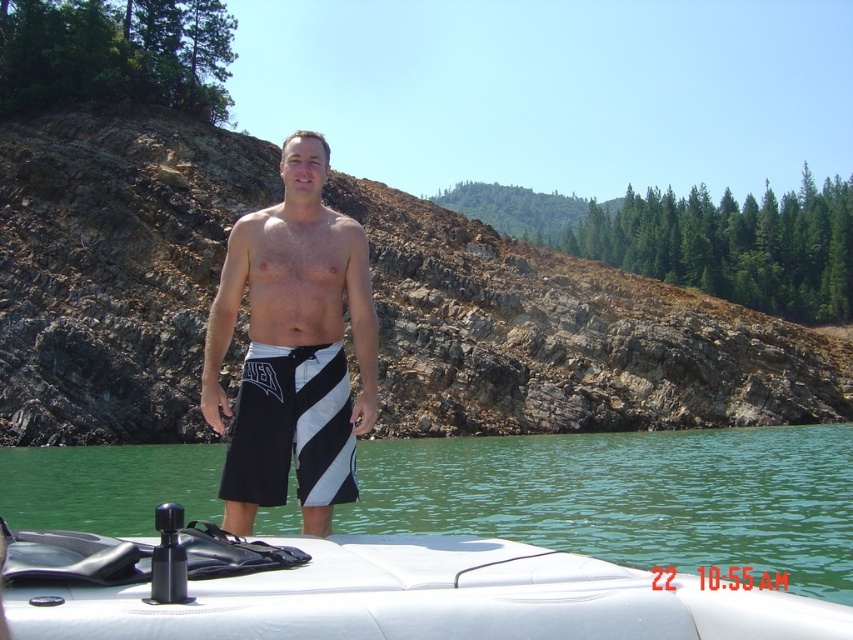
You are a photographer on the boat and want to take a picture of the black and white striped shorts at center and the green water at center. Which object is closer to the camera?

The green water at center is closer to the camera than the black and white striped shorts at center because the black and white striped shorts at center is behind green water at center.

You are a photographer trying to capture a photo of the green water at center and the black and white striped shorts at center from a distance of 70 feet. Will both subjects be in focus if your camera has a depth of field that can cover 70 feet?

The distance between the green water at center and the black and white striped shorts at center is 71.23 feet. Since the depth of field can only cover 70 feet, the subjects are slightly beyond the camera range, so both might not be in focus simultaneously.

You are a drone operator trying to locate the white matte boat at center in a satellite image. The satellite image has a coordinate system where the bottom left corner is at point 0.0 and the top right corner is at point 1.0. The boat is at point 0.923 in the x axis and 0.433 in the y axis. If you want to move the drone to the boat, which direction should you move the drone from the bottom left corner?

The white matte boat at center is located at coordinates x 0.923 and y 0.433. Since the bottom left corner is 0.0, moving towards higher x values means moving to the right, and higher y values mean moving up. To reach the boat from the bottom left corner, you should move the drone to the right and slightly upwards.